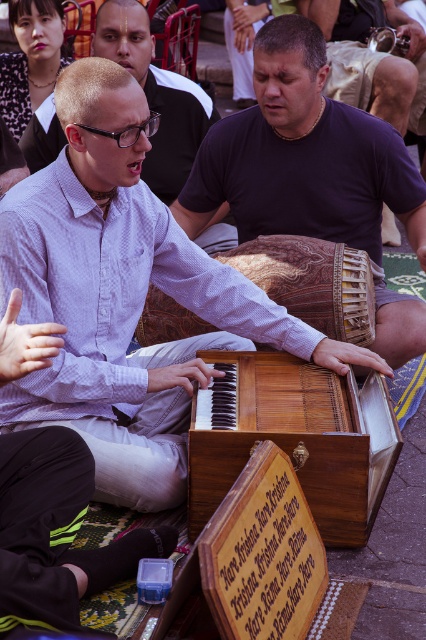
Question: Based on their relative distances, which object is nearer to the wooden piano at center?

Choices:
 (A) dark purple fabric at center
 (B) wooden harmonium at center
 (C) wooden drum at center

Answer: (B)

Question: Is dark purple fabric at center above wooden drum at center?

Choices:
 (A) yes
 (B) no

Answer: (B)

Question: Which object appears farthest from the camera in this image?

Choices:
 (A) wooden harmonium at center
 (B) wooden piano at center

Answer: (B)

Question: Does wooden harmonium at center appear under wooden drum at center?

Choices:
 (A) no
 (B) yes

Answer: (B)

Question: Is wooden harmonium at center to the right of dark purple fabric at center from the viewer's perspective?

Choices:
 (A) no
 (B) yes

Answer: (A)

Question: Considering the real-world distances, which object is farthest from the dark purple fabric at center?

Choices:
 (A) wooden drum at center
 (B) wooden harmonium at center
 (C) wooden piano at center

Answer: (A)